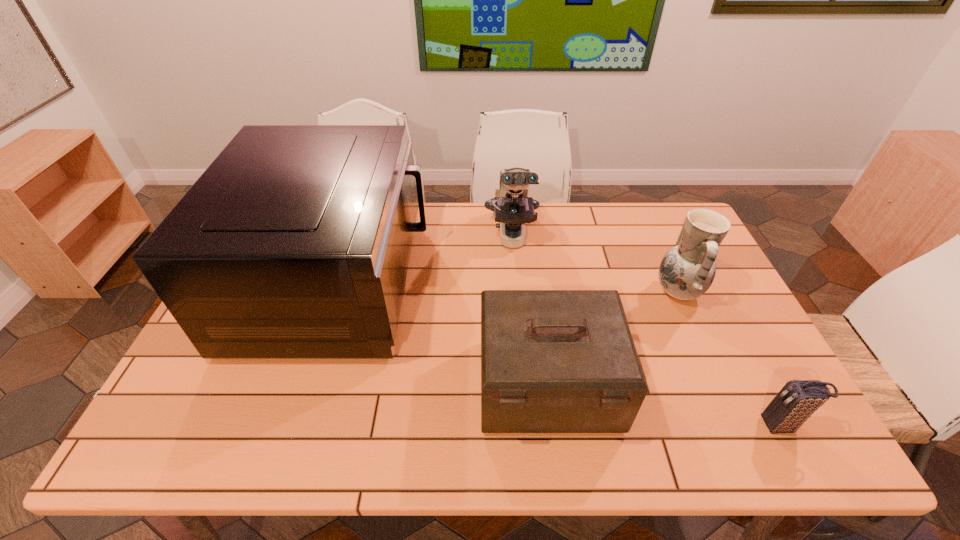
This screenshot has width=960, height=540. I want to click on microwave_oven, so click(295, 243).

Find the location of a particular element. microscope is located at coordinates (512, 208).

You are a GUI agent. You are given a task and a screenshot of the screen. Output one action in this format:
    pyautogui.click(x=<x>, y=<y>)
    Task: Click on the pottery
    The image size is (960, 540).
    Given the screenshot: What is the action you would take?
    pyautogui.click(x=686, y=272)

This screenshot has height=540, width=960. Find the location of `the first-aid kit`. the first-aid kit is located at coordinates (552, 361).

Identify the location of the shortest object. (798, 399).

Locate an element on the screen. This screenshot has width=960, height=540. blank space located on the front-facing side of the microwave_oven is located at coordinates coord(550,283).

The height and width of the screenshot is (540, 960). In order to click on vacant area located through the eyepieces of the microscope in this screenshot , I will do `click(518, 310)`.

Where is `vacant space located 0.070m on either side of the pottery`? The image size is (960, 540). vacant space located 0.070m on either side of the pottery is located at coordinates (630, 292).

Locate an element on the screen. This screenshot has width=960, height=540. free space located 0.170m on either side of the pottery is located at coordinates (596, 292).

Find the location of a particular element. vacant region located on either side of the pottery is located at coordinates (583, 292).